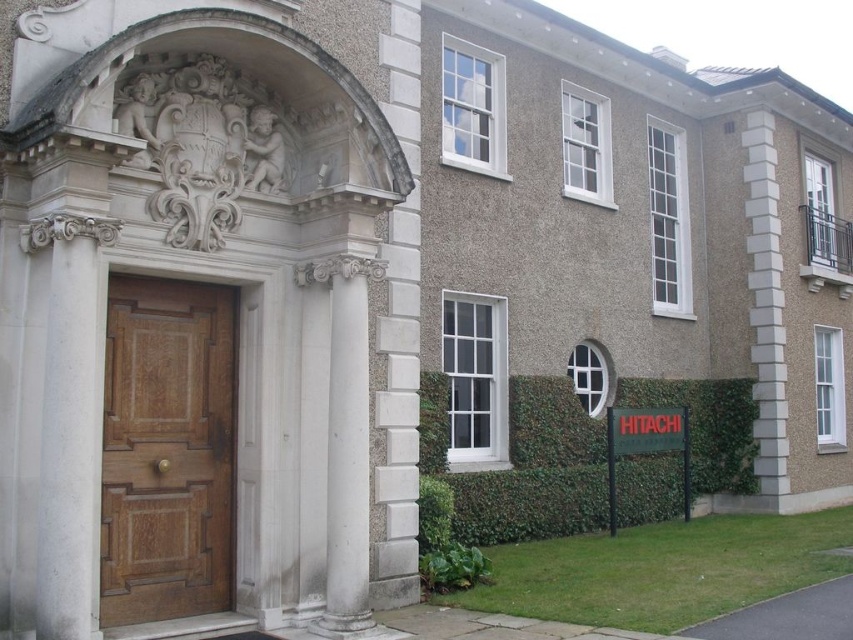
You are standing in front of the classical building and notice two points marked on its facade. The first point is at coordinate point (228,608), and the second is at point (534,468). Which of these two points appears closer to you when observing the building?

Point (228,608) is closer to the viewer than point (534,468).

You are standing in front of the building and want to enter through the wooden panelled door at center. To your right, there is a green ivy hedge at lower right. Which direction should you walk to reach the door from the hedge?

The wooden panelled door at center is to the left of the green ivy hedge at lower right. Therefore, you should walk to your left to reach the door from the hedge.